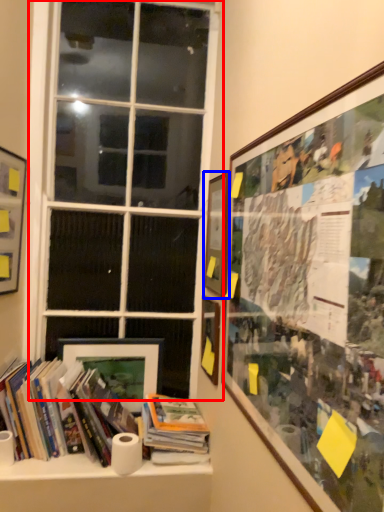
Question: Which point is closer to the camera, window (highlighted by a red box) or picture frame (highlighted by a blue box)?

Choices:
 (A) window
 (B) picture frame

Answer: (B)